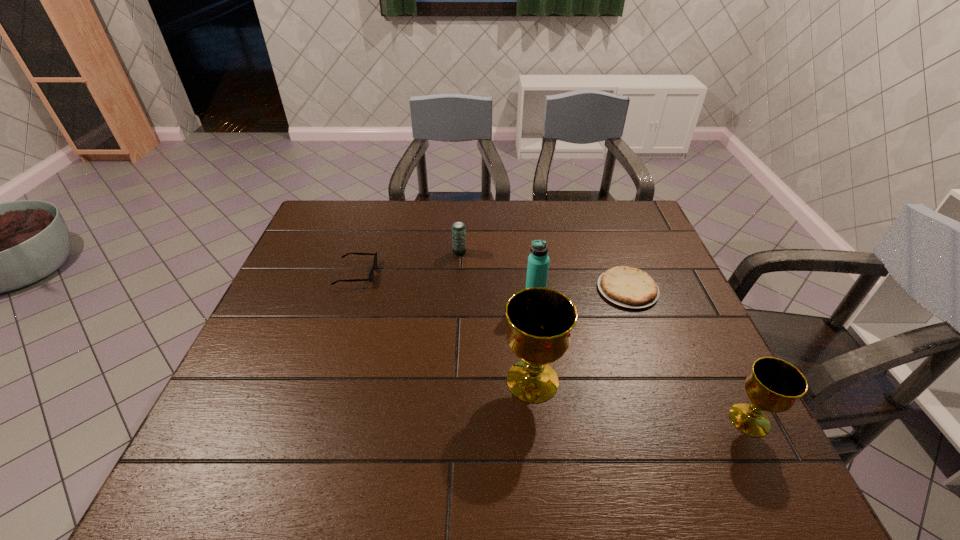
Find the location of a particular element. The image size is (960, 540). object that is at the near right corner is located at coordinates (x=774, y=385).

The width and height of the screenshot is (960, 540). In the image, there is a desktop. In order to click on vacant space at the far edge in this screenshot , I will do `click(541, 225)`.

Find the location of a particular element. free space at the near edge of the desktop is located at coordinates (415, 408).

At what (x,y) coordinates should I click in order to perform the action: click on free space at the left edge. Please return your answer as a coordinate pair (x, y). Looking at the image, I should click on (316, 284).

In the image, there is a desktop. At what (x,y) coordinates should I click in order to perform the action: click on vacant space at the right edge. Please return your answer as a coordinate pair (x, y). Image resolution: width=960 pixels, height=540 pixels. Looking at the image, I should click on (705, 375).

Find the location of a particular element. This screenshot has height=540, width=960. vacant space at the far right corner is located at coordinates (612, 207).

Where is `vacant space in between the left chalice and the fourth shortest object`? This screenshot has height=540, width=960. vacant space in between the left chalice and the fourth shortest object is located at coordinates (641, 400).

The width and height of the screenshot is (960, 540). I want to click on free point between the shorter chalice and the shortest object, so click(x=688, y=355).

This screenshot has height=540, width=960. I want to click on empty space that is in between the beer can and the left chalice, so click(x=496, y=316).

The width and height of the screenshot is (960, 540). I want to click on free spot between the fourth shortest object and the thermos bottle, so [x=642, y=358].